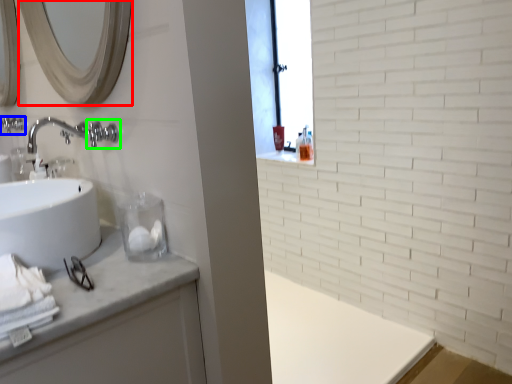
Question: Which is farther away from mirror (highlighted by a red box)? plumbing fixture (highlighted by a blue box) or plumbing fixture (highlighted by a green box)?

Choices:
 (A) plumbing fixture
 (B) plumbing fixture

Answer: (A)